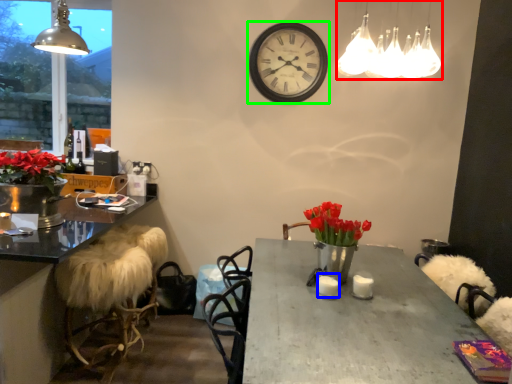
Question: Which is farther away from lamp (highlighted by a red box)? candle (highlighted by a blue box) or wall clock (highlighted by a green box)?

Choices:
 (A) candle
 (B) wall clock

Answer: (B)